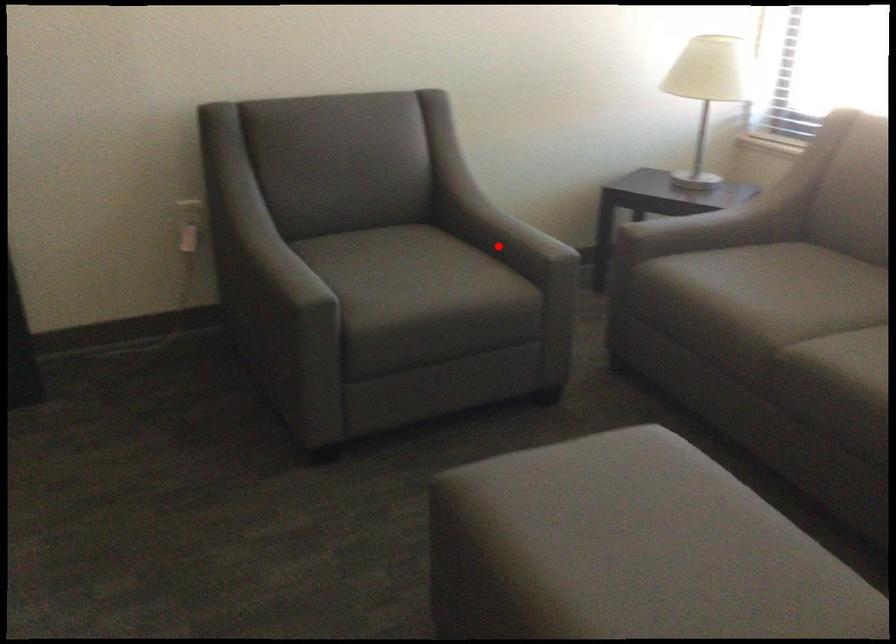
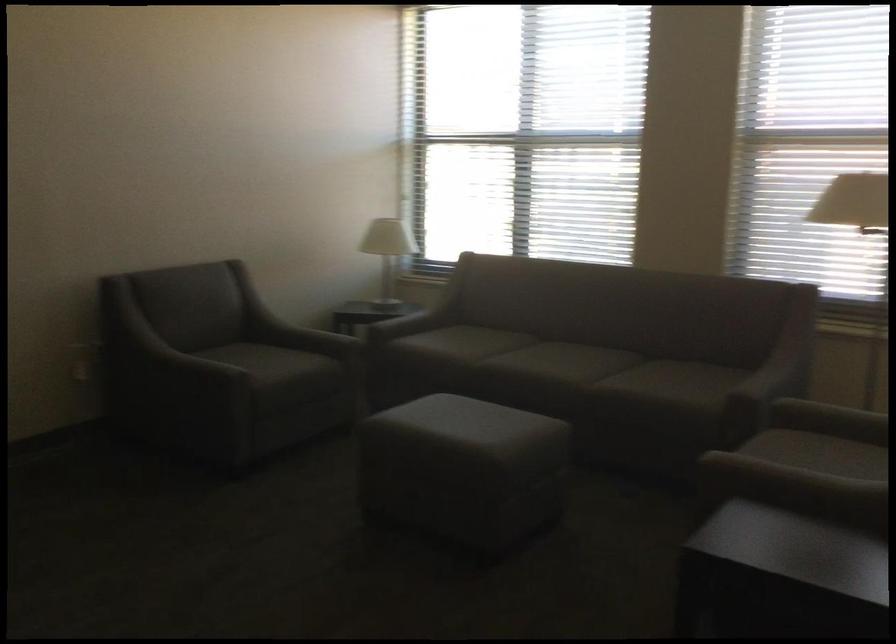
Question: I am providing you with two images of the same scene from different viewpoints. In image1, a red point is highlighted. Considering the same 3D point in image2, which of the following is correct?

Choices:
 (A) It is closer
 (B) It is farther

Answer: (B)